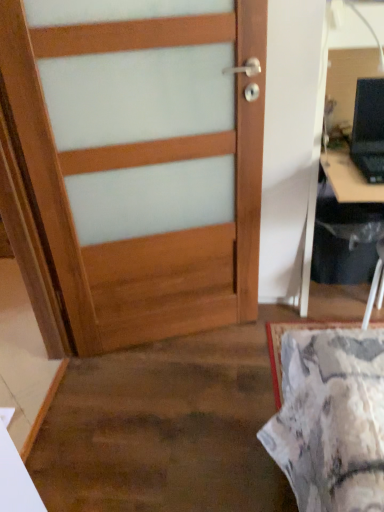
Question: Is black plastic computer desk at right taller than black plastic laptop at upper right?

Choices:
 (A) no
 (B) yes

Answer: (B)

Question: Is black plastic computer desk at right to the left of black plastic laptop at upper right from the viewer's perspective?

Choices:
 (A) no
 (B) yes

Answer: (A)

Question: Is black plastic computer desk at right at the right side of black plastic laptop at upper right?

Choices:
 (A) no
 (B) yes

Answer: (B)

Question: From a real-world perspective, is black plastic computer desk at right on top of black plastic laptop at upper right?

Choices:
 (A) yes
 (B) no

Answer: (B)

Question: Is black plastic computer desk at right surrounding black plastic laptop at upper right?

Choices:
 (A) yes
 (B) no

Answer: (A)

Question: Is wooden door at center wider or thinner than black plastic computer desk at right?

Choices:
 (A) wide
 (B) thin

Answer: (B)

Question: Would you say wooden door at center is to the left or to the right of black plastic computer desk at right in the picture?

Choices:
 (A) right
 (B) left

Answer: (B)

Question: From a real-world perspective, is wooden door at center positioned above or below black plastic computer desk at right?

Choices:
 (A) below
 (B) above

Answer: (B)

Question: Would you say wooden door at center is inside or outside black plastic computer desk at right?

Choices:
 (A) inside
 (B) outside

Answer: (B)

Question: Considering the positions of black plastic laptop at upper right and wooden door at center in the image, is black plastic laptop at upper right bigger or smaller than wooden door at center?

Choices:
 (A) small
 (B) big

Answer: (A)

Question: Visually, is black plastic laptop at upper right positioned to the left or to the right of wooden door at center?

Choices:
 (A) left
 (B) right

Answer: (B)

Question: Considering the positions of point coord(380,110) and point coord(153,114), is point coord(380,110) closer or farther from the camera than point coord(153,114)?

Choices:
 (A) farther
 (B) closer

Answer: (A)

Question: In terms of width, does black plastic laptop at upper right look wider or thinner when compared to wooden door at center?

Choices:
 (A) wide
 (B) thin

Answer: (A)

Question: From their relative heights in the image, would you say black plastic computer desk at right is taller or shorter than wooden door at center?

Choices:
 (A) short
 (B) tall

Answer: (A)

Question: Considering the positions of black plastic computer desk at right and wooden door at center in the image, is black plastic computer desk at right bigger or smaller than wooden door at center?

Choices:
 (A) small
 (B) big

Answer: (B)